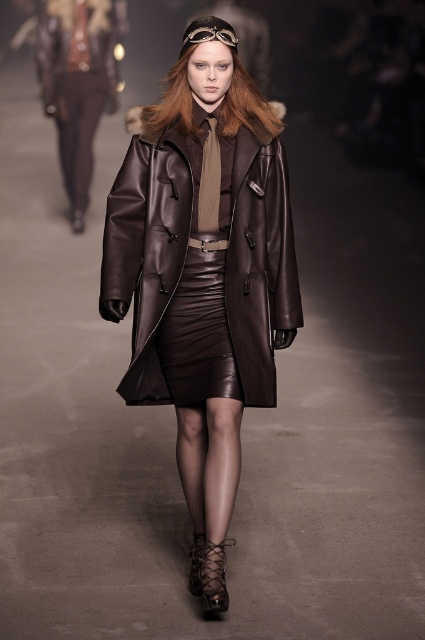
Who is more forward, (x=170, y=280) or (x=79, y=129)?

Positioned in front is point (x=170, y=280).

Find the location of a particular element. matte leather trench coat at center is located at coordinates (147, 250).

How far apart are matte leather pants at center and matte brown leather pants at left?

matte leather pants at center is 20.65 inches away from matte brown leather pants at left.

Does matte leather pants at center lie behind matte brown leather pants at left?

Yes, matte leather pants at center is behind matte brown leather pants at left.

I want to click on matte leather pants at center, so click(x=78, y=83).

Looking at this image, is matte leather trench coat at center smaller than matte brown leather pants at left?

Yes.

This screenshot has height=640, width=425. What do you see at coordinates (147, 250) in the screenshot? I see `matte leather trench coat at center` at bounding box center [147, 250].

Image resolution: width=425 pixels, height=640 pixels. Find the location of `matte leather trench coat at center`. matte leather trench coat at center is located at coordinates (147, 250).